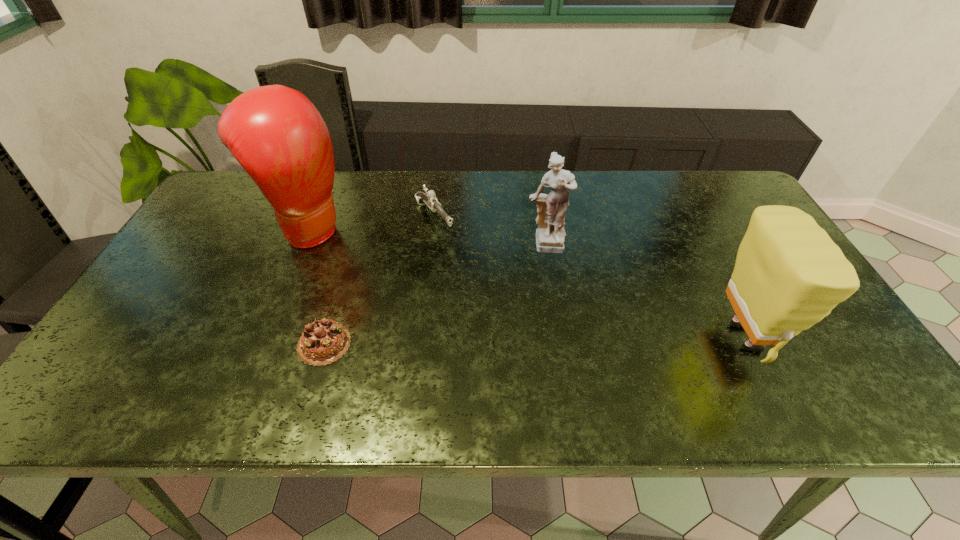
Image resolution: width=960 pixels, height=540 pixels. What are the coordinates of `free space between the chocolate cake and the sponge` in the screenshot? It's located at (534, 341).

Locate an element on the screen. The image size is (960, 540). free space between the chocolate cake and the sponge is located at coordinates (534, 341).

Locate an element on the screen. Image resolution: width=960 pixels, height=540 pixels. vacant space in between the rightmost object and the shortest object is located at coordinates (x=534, y=341).

The image size is (960, 540). What are the coordinates of `free point between the boxing glove and the figurine` in the screenshot? It's located at (428, 237).

Image resolution: width=960 pixels, height=540 pixels. I want to click on free space between the chocolate cake and the sponge, so click(534, 341).

Locate an element on the screen. free space between the tallest object and the second shortest object is located at coordinates (372, 222).

The width and height of the screenshot is (960, 540). What are the coordinates of `the fourth closest object to the chocolate cake` in the screenshot? It's located at 789,274.

Locate which object is the closest to the chocolate cake. Please provide its 2D coordinates. Your answer should be formatted as a tuple, i.e. [(x, y)], where the tuple contains the x and y coordinates of a point satisfying the conditions above.

[(277, 135)]

This screenshot has width=960, height=540. I want to click on free space that satisfies the following two spatial constraints: 1. on the front side of the fourth object from left to right; 2. on the left side of the boxing glove, so click(x=302, y=247).

In order to click on free location that satisfies the following two spatial constraints: 1. on the front side of the figurine; 2. on the right side of the boxing glove in this screenshot , I will do `click(302, 247)`.